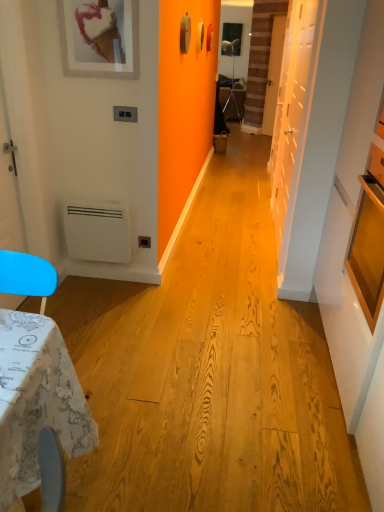
Question: Is matte black tripod at center thinner than white matte door at right, placed as the 1th door when sorted from front to back?

Choices:
 (A) no
 (B) yes

Answer: (A)

Question: From the image's perspective, does matte black tripod at center appear lower than white matte door at right, positioned as the 1th door in bottom-to-top order?

Choices:
 (A) no
 (B) yes

Answer: (A)

Question: From a real-world perspective, is matte black tripod at center physically above white matte door at right, placed as the 2th door when sorted from right to left?

Choices:
 (A) yes
 (B) no

Answer: (B)

Question: Is matte black tripod at center to the right of white matte door at right, which ranks as the second door in top-to-bottom order, from the viewer's perspective?

Choices:
 (A) no
 (B) yes

Answer: (B)

Question: Considering the relative sizes of matte black tripod at center and white matte door at right, positioned as the 1th door in left-to-right order, in the image provided, is matte black tripod at center shorter than white matte door at right, positioned as the 1th door in left-to-right order,?

Choices:
 (A) no
 (B) yes

Answer: (B)

Question: Can you confirm if matte black tripod at center is wider than white matte door at right, which is counted as the second door, starting from the back?

Choices:
 (A) yes
 (B) no

Answer: (A)

Question: Is white matte picture frame at upper left further to camera compared to white matte door at right, which ranks as the second door in top-to-bottom order?

Choices:
 (A) no
 (B) yes

Answer: (A)

Question: Considering the relative sizes of white matte picture frame at upper left and white matte door at right, positioned as the 1th door in left-to-right order, in the image provided, is white matte picture frame at upper left smaller than white matte door at right, positioned as the 1th door in left-to-right order,?

Choices:
 (A) yes
 (B) no

Answer: (A)

Question: From a real-world perspective, is white matte picture frame at upper left physically above white matte door at right, placed as the 1th door when sorted from front to back?

Choices:
 (A) yes
 (B) no

Answer: (A)

Question: From the image's perspective, is white matte picture frame at upper left below white matte door at right, positioned as the 1th door in bottom-to-top order?

Choices:
 (A) no
 (B) yes

Answer: (A)

Question: Considering the relative positions of white matte picture frame at upper left and white matte door at right, which is counted as the second door, starting from the back, in the image provided, is white matte picture frame at upper left to the left of white matte door at right, which is counted as the second door, starting from the back, from the viewer's perspective?

Choices:
 (A) no
 (B) yes

Answer: (B)

Question: Is white matte picture frame at upper left closer to the viewer compared to white matte door at right, positioned as the 1th door in bottom-to-top order?

Choices:
 (A) no
 (B) yes

Answer: (B)

Question: Is white matte heater at lower left at the right side of white matte picture frame at upper left?

Choices:
 (A) no
 (B) yes

Answer: (A)